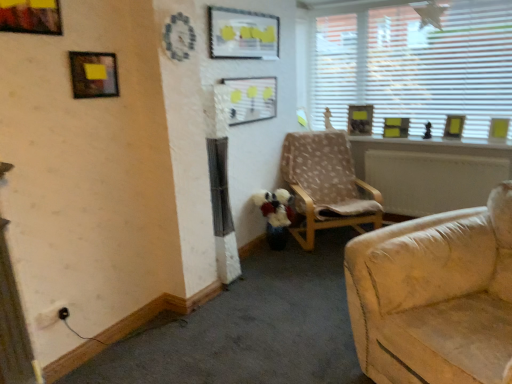
Question: Does matte black picture frame at upper left, the second picture frame in the left-to-right sequence, come behind light brown fabric chair at center?

Choices:
 (A) yes
 (B) no

Answer: (B)

Question: Considering the relative sizes of matte black picture frame at upper left, positioned as the 7th picture frame in back-to-front order, and light brown fabric chair at center in the image provided, is matte black picture frame at upper left, positioned as the 7th picture frame in back-to-front order, smaller than light brown fabric chair at center?

Choices:
 (A) no
 (B) yes

Answer: (B)

Question: Is matte black picture frame at upper left, the 7th picture frame positioned from the right, far away from light brown fabric chair at center?

Choices:
 (A) yes
 (B) no

Answer: (A)

Question: Is matte black picture frame at upper left, which ranks as the 2th picture frame in front-to-back order, looking in the opposite direction of light brown fabric chair at center?

Choices:
 (A) no
 (B) yes

Answer: (A)

Question: Is matte black picture frame at upper left, the 7th picture frame positioned from the right, shorter than light brown fabric chair at center?

Choices:
 (A) no
 (B) yes

Answer: (B)

Question: Is matte black picture frame at upper left, the 7th picture frame positioned from the right, beside light brown fabric chair at center?

Choices:
 (A) yes
 (B) no

Answer: (B)

Question: Is wooden picture frame at upper right, positioned as the eighth picture frame in front-to-back order, bigger than yellow matte picture frame at upper right, marked as the 6th picture frame in a left-to-right arrangement?

Choices:
 (A) no
 (B) yes

Answer: (B)

Question: From the image's perspective, is wooden picture frame at upper right, positioned as the eighth picture frame in front-to-back order, located above yellow matte picture frame at upper right, which ranks as the 3th picture frame in right-to-left order?

Choices:
 (A) yes
 (B) no

Answer: (A)

Question: Does wooden picture frame at upper right, positioned as the eighth picture frame in front-to-back order, have a greater height compared to yellow matte picture frame at upper right, which ranks as the 3th picture frame in right-to-left order?

Choices:
 (A) yes
 (B) no

Answer: (A)

Question: Is wooden picture frame at upper right, acting as the 4th picture frame starting from the right, in front of yellow matte picture frame at upper right, which ranks as the 3th picture frame in right-to-left order?

Choices:
 (A) no
 (B) yes

Answer: (A)

Question: Considering the relative sizes of wooden picture frame at upper right, marked as the 1th picture frame in a back-to-front arrangement, and yellow matte picture frame at upper right, the 2th picture frame in the back-to-front sequence, in the image provided, is wooden picture frame at upper right, marked as the 1th picture frame in a back-to-front arrangement, wider than yellow matte picture frame at upper right, the 2th picture frame in the back-to-front sequence,?

Choices:
 (A) yes
 (B) no

Answer: (A)

Question: Is wooden picture frame at upper right, the 5th picture frame viewed from the left, at the right side of yellow matte picture frame at upper right, which ranks as the 3th picture frame in right-to-left order?

Choices:
 (A) no
 (B) yes

Answer: (A)

Question: Is metallic gold picture frame at upper left, the eighth picture frame when ordered from right to left, further to camera compared to matte plastic picture frame at upper center, acting as the third picture frame starting from the front?

Choices:
 (A) yes
 (B) no

Answer: (B)